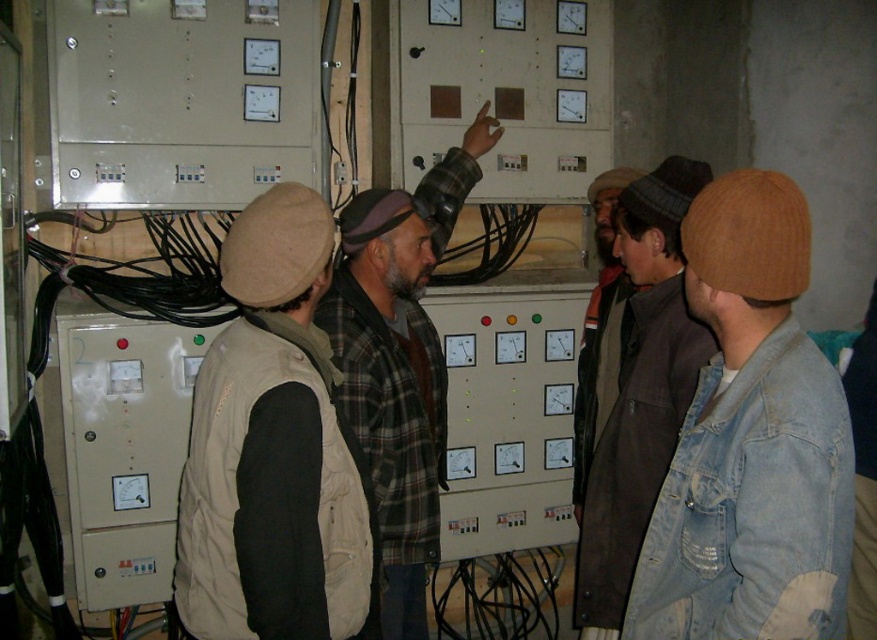
Based on the photo, you are standing in the utility room and need to locate the beige fabric vest at center. According to the coordinates provided, where would you find it?

The beige fabric vest at center is located at point (272,449).

You are standing 1.5 meters away from the industrial control panel. There is a point labeled as point (833, 412) on the panel. If you want to reach that point with your hand, will you be able to do so without moving closer?

The distance of point (833, 412) from viewer is 1.23 meters. Since you are currently 1.5 meters away, you need to move 0.27 meters closer to reach it.